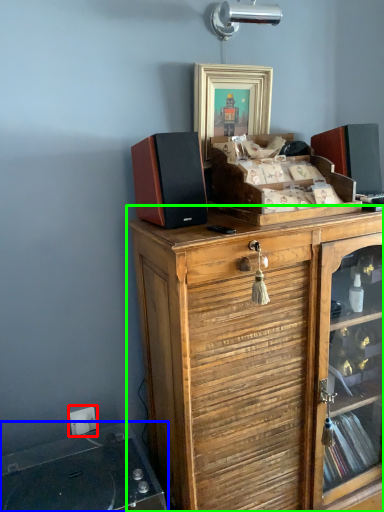
Question: Which object is positioned farthest from electric outlet (highlighted by a red box)? Select from wide (highlighted by a blue box) and cabinetry (highlighted by a green box).

Choices:
 (A) wide
 (B) cabinetry

Answer: (B)